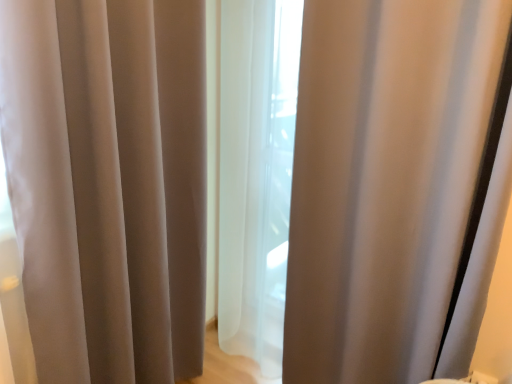
Question: Is point (110, 26) positioned closer to the camera than point (460, 299)?

Choices:
 (A) closer
 (B) farther

Answer: (A)

Question: Considering the positions of satin beige curtain at center, the 2th curtain positioned from the right, and satin-like beige curtain at center, which ranks as the 2th curtain in left-to-right order, in the image, is satin beige curtain at center, the 2th curtain positioned from the right, wider or thinner than satin-like beige curtain at center, which ranks as the 2th curtain in left-to-right order,?

Choices:
 (A) wide
 (B) thin

Answer: (B)

Question: From the image's perspective, relative to satin-like beige curtain at center, positioned as the first curtain in right-to-left order, is satin beige curtain at center, which is counted as the first curtain, starting from the left, above or below?

Choices:
 (A) above
 (B) below

Answer: (B)

Question: Is point (396, 64) closer or farther from the camera than point (1, 43)?

Choices:
 (A) closer
 (B) farther

Answer: (B)

Question: Visually, is satin-like beige curtain at center, positioned as the first curtain in right-to-left order, positioned to the left or to the right of satin beige curtain at center, which is counted as the first curtain, starting from the left?

Choices:
 (A) left
 (B) right

Answer: (B)

Question: Is satin-like beige curtain at center, positioned as the first curtain in right-to-left order, wider or thinner than satin beige curtain at center, the 2th curtain positioned from the right?

Choices:
 (A) wide
 (B) thin

Answer: (A)

Question: Choose the correct answer: Is satin-like beige curtain at center, positioned as the first curtain in right-to-left order, inside satin beige curtain at center, which is counted as the first curtain, starting from the left, or outside it?

Choices:
 (A) inside
 (B) outside

Answer: (B)